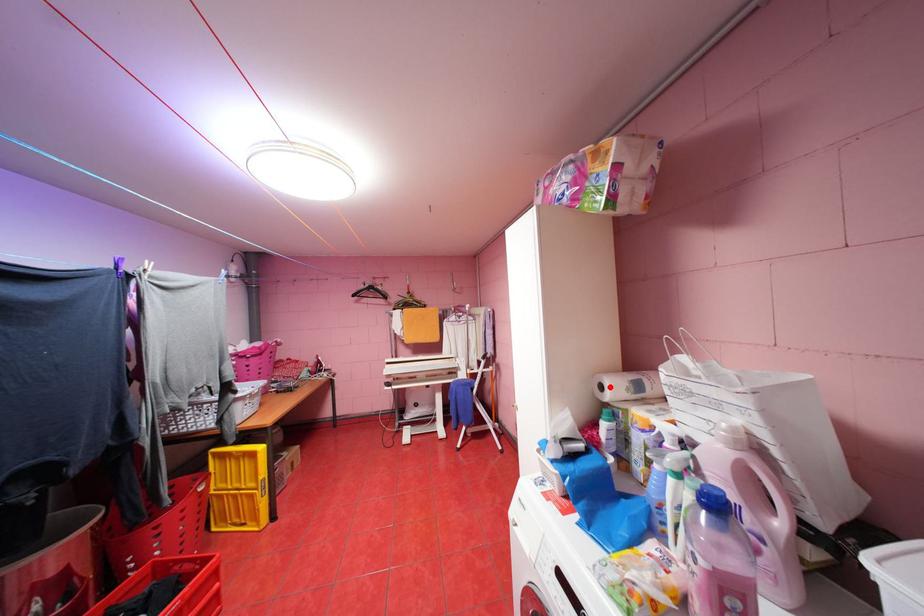
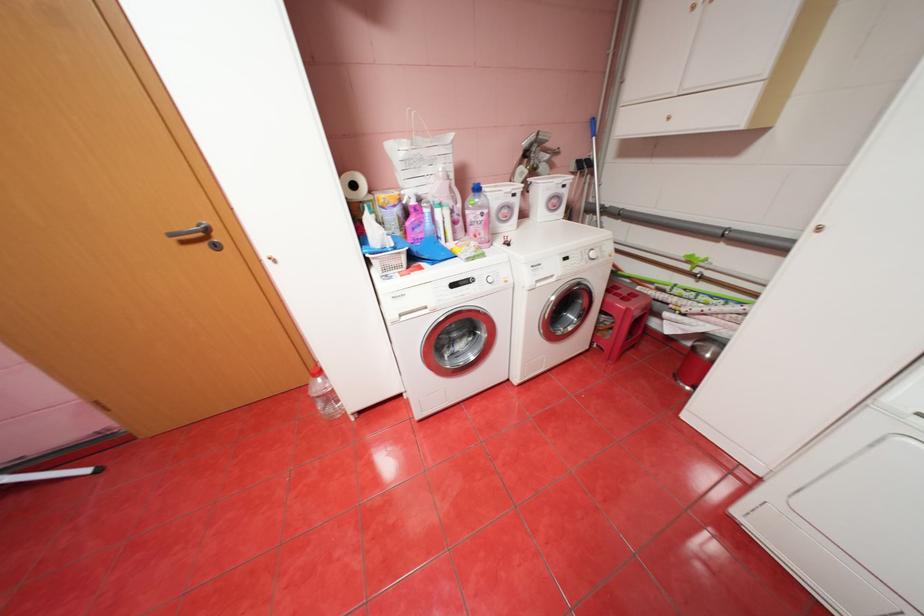
Question: I am providing you with two images of the same scene from different viewpoints. A red point is marked on the first image. At the location where the point appears in image 1, is it still visible in image 2?

Choices:
 (A) Yes
 (B) No

Answer: (A)